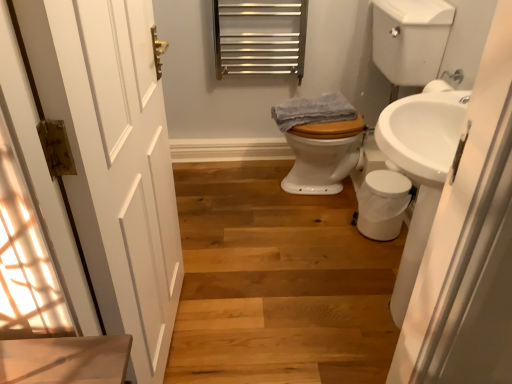
Image resolution: width=512 pixels, height=384 pixels. What are the coordinates of `vacant space to the left of white glossy sink at right` in the screenshot? It's located at (290, 319).